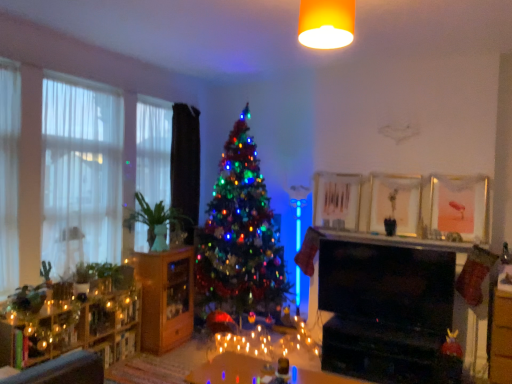
Question: Is white sheer curtains at left, positioned as the second window in right-to-left order, completely or partially outside of green matte plant at left, which appears as the 1th plant when ordered from the bottom?

Choices:
 (A) yes
 (B) no

Answer: (A)

Question: Considering the relative sizes of white sheer curtains at left, positioned as the second window in right-to-left order, and green matte plant at left, which appears as the 1th plant when ordered from the bottom, in the image provided, is white sheer curtains at left, positioned as the second window in right-to-left order, bigger than green matte plant at left, which appears as the 1th plant when ordered from the bottom,?

Choices:
 (A) yes
 (B) no

Answer: (A)

Question: Is white sheer curtains at left, which is counted as the first window, starting from the left, thinner than green matte plant at left, the 2th plant when ordered from top to bottom?

Choices:
 (A) no
 (B) yes

Answer: (B)

Question: Does white sheer curtains at left, marked as the 1th window in a front-to-back arrangement, contain green matte plant at left, which appears as the 1th plant when ordered from the bottom?

Choices:
 (A) no
 (B) yes

Answer: (A)

Question: Is white sheer curtains at left, the 2th window when ordered from back to front, taller than green matte plant at left, the 2th plant when ordered from top to bottom?

Choices:
 (A) yes
 (B) no

Answer: (A)

Question: Is white sheer curtains at left, marked as the 1th window in a front-to-back arrangement, positioned behind green matte plant at left, the 2th plant when ordered from top to bottom?

Choices:
 (A) yes
 (B) no

Answer: (B)

Question: Is metallic gold picture frame at upper center, which ranks as the second picture frame in right-to-left order, next to pink matte picture frame at upper right, placed as the first picture frame when sorted from right to left, and touching it?

Choices:
 (A) no
 (B) yes

Answer: (A)

Question: Can you confirm if metallic gold picture frame at upper center, placed as the 1th picture frame when sorted from left to right, is smaller than pink matte picture frame at upper right, placed as the first picture frame when sorted from right to left?

Choices:
 (A) yes
 (B) no

Answer: (A)

Question: Can you confirm if metallic gold picture frame at upper center, placed as the 1th picture frame when sorted from left to right, is wider than pink matte picture frame at upper right, acting as the 2th picture frame starting from the left?

Choices:
 (A) no
 (B) yes

Answer: (A)

Question: Could you tell me if metallic gold picture frame at upper center, placed as the 1th picture frame when sorted from left to right, is turned towards pink matte picture frame at upper right, acting as the 2th picture frame starting from the left?

Choices:
 (A) yes
 (B) no

Answer: (B)

Question: Is metallic gold picture frame at upper center, which ranks as the second picture frame in right-to-left order, closer to the viewer compared to pink matte picture frame at upper right, acting as the 2th picture frame starting from the left?

Choices:
 (A) no
 (B) yes

Answer: (A)

Question: Considering the relative sizes of metallic gold picture frame at upper center, placed as the 1th picture frame when sorted from left to right, and pink matte picture frame at upper right, acting as the 2th picture frame starting from the left, in the image provided, is metallic gold picture frame at upper center, placed as the 1th picture frame when sorted from left to right, taller than pink matte picture frame at upper right, acting as the 2th picture frame starting from the left,?

Choices:
 (A) yes
 (B) no

Answer: (B)

Question: Is yellow matte light fixture at upper center smaller than shiny multicolored tree at center?

Choices:
 (A) no
 (B) yes

Answer: (B)